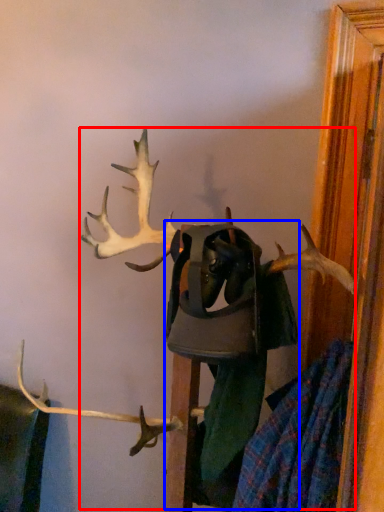
Question: Among these objects, which one is nearest to the camera, deer (highlighted by a red box) or clothing (highlighted by a blue box)?

Choices:
 (A) deer
 (B) clothing

Answer: (A)